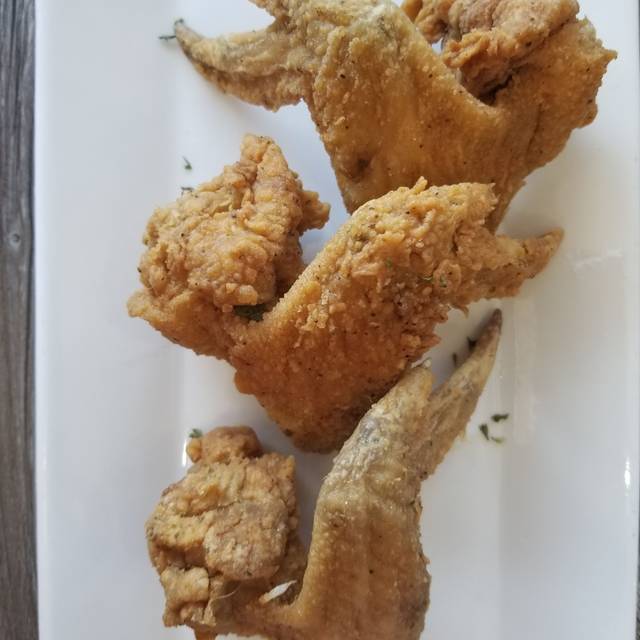
The width and height of the screenshot is (640, 640). I want to click on table, so click(9, 518).